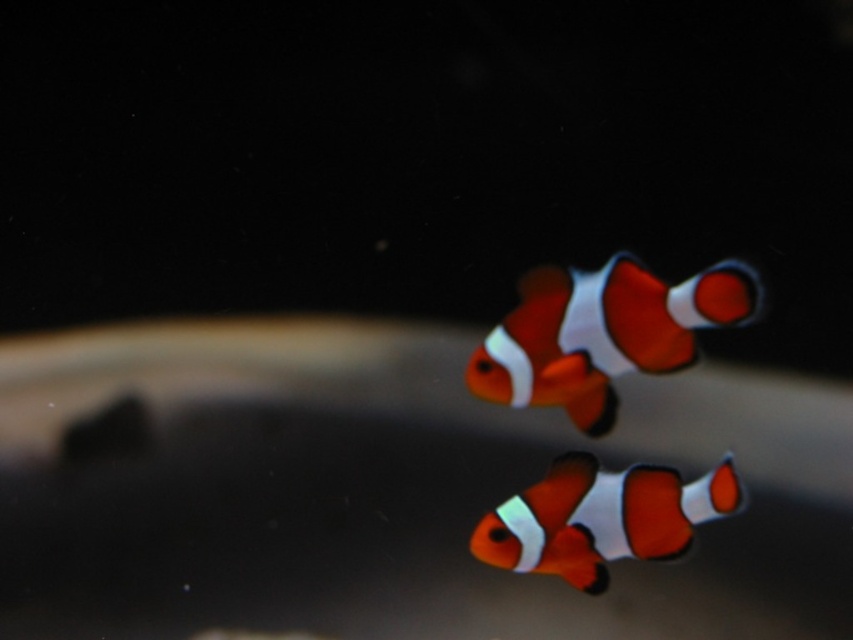
Which is in front, point (532, 401) or point (548, 515)?

Point (532, 401)

Does point (544, 285) come closer to viewer compared to point (672, 547)?

No, it is behind (672, 547).

Who is more forward, [537,342] or [583,456]?

Point [583,456]

Locate an element on the screen. The width and height of the screenshot is (853, 640). orange and white clownfish at center is located at coordinates (602, 333).